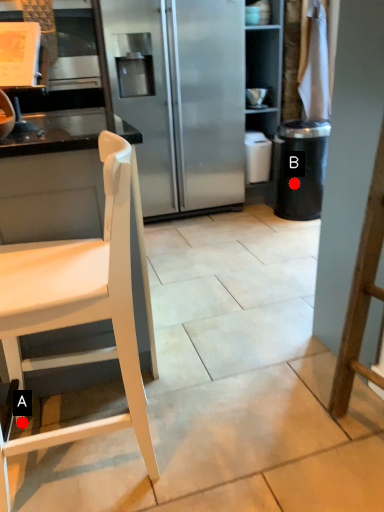
Question: Two points are circled on the image, labeled by A and B beside each circle. Which point is closer to the camera?

Choices:
 (A) A is closer
 (B) B is closer

Answer: (A)